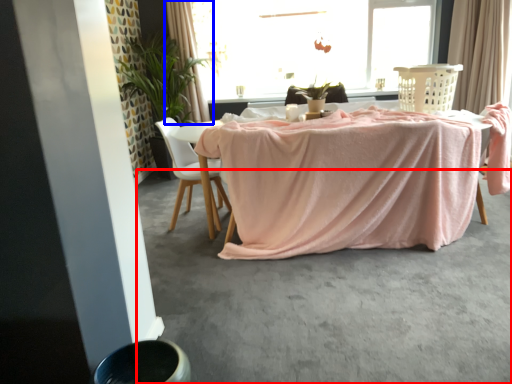
Question: Among these objects, which one is nearest to the camera, concrete (highlighted by a red box) or curtain (highlighted by a blue box)?

Choices:
 (A) concrete
 (B) curtain

Answer: (A)